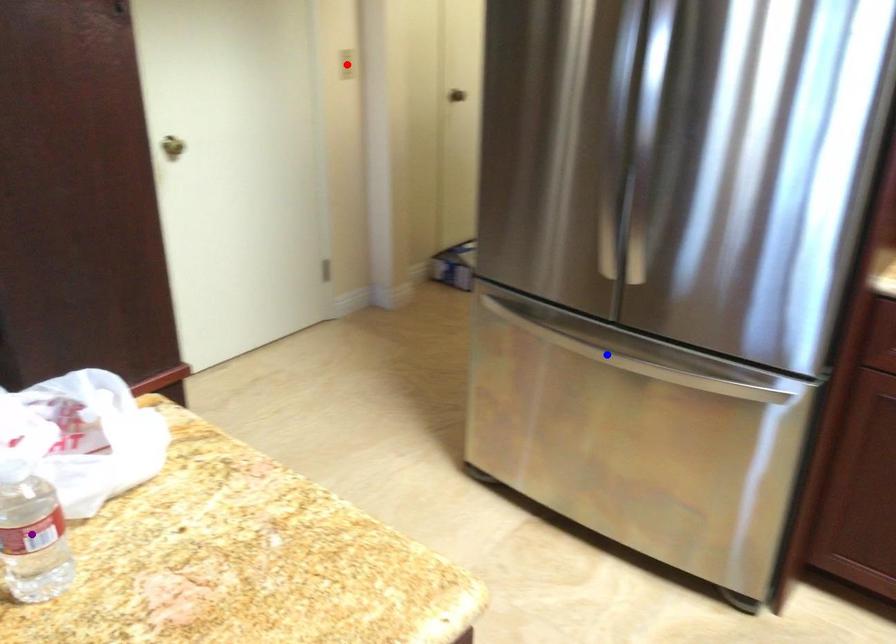
Order these from farthest to nearest:
purple point, blue point, red point

red point
blue point
purple point